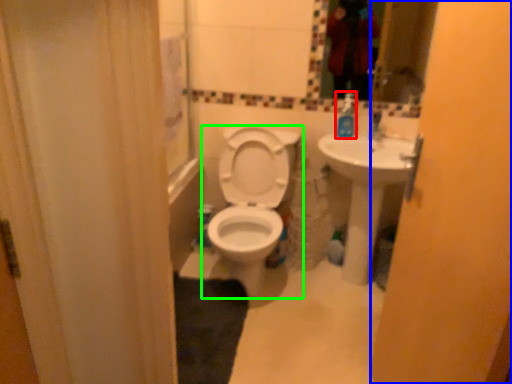
Question: Considering the real-world distances, which object is closest to soap dispenser (highlighted by a red box)? screen door (highlighted by a blue box) or toilet (highlighted by a green box).

Choices:
 (A) screen door
 (B) toilet

Answer: (B)